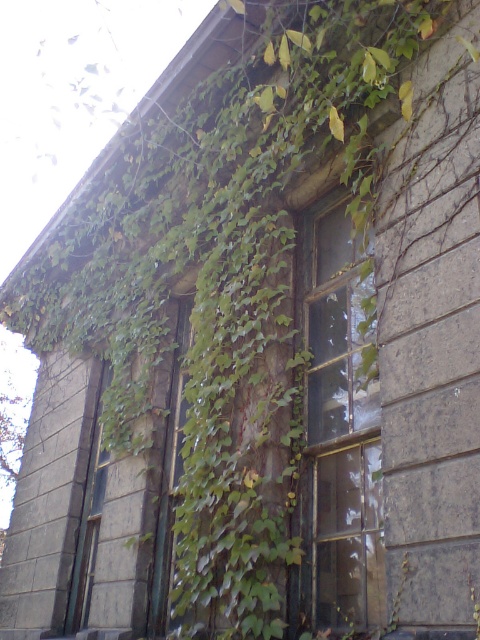
Can you confirm if transparent glass window at center is thinner than green mossy door at center?

In fact, transparent glass window at center might be wider than green mossy door at center.

Does transparent glass window at center appear on the left side of green mossy door at center?

No, transparent glass window at center is not to the left of green mossy door at center.

Is point (301, 221) more distant than point (172, 406)?

No.

Where is `transparent glass window at center`? The width and height of the screenshot is (480, 640). transparent glass window at center is located at coordinates (336, 432).